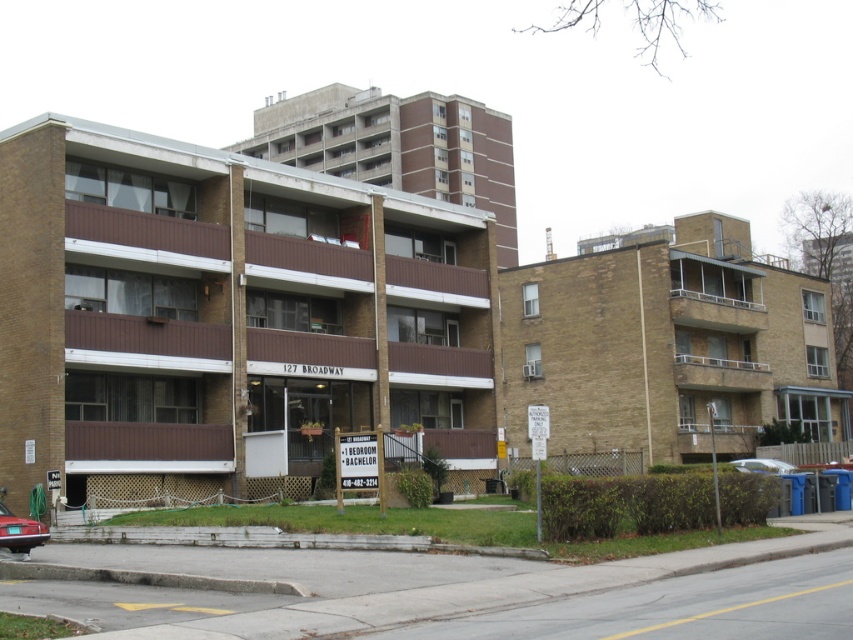
Question: Which object is closer to the camera taking this photo?

Choices:
 (A) white glossy sedan at lower right
 (B) shiny red sedan at lower left

Answer: (B)

Question: Which point is closer to the camera?

Choices:
 (A) white glossy sedan at lower right
 (B) shiny red sedan at lower left

Answer: (B)

Question: Which of the following is the closest to the observer?

Choices:
 (A) (785, 468)
 (B) (20, 524)

Answer: (B)

Question: Does shiny red sedan at lower left come in front of white glossy sedan at lower right?

Choices:
 (A) yes
 (B) no

Answer: (A)

Question: From the image, what is the correct spatial relationship of shiny red sedan at lower left in relation to white glossy sedan at lower right?

Choices:
 (A) left
 (B) right

Answer: (A)

Question: Does shiny red sedan at lower left lie behind white glossy sedan at lower right?

Choices:
 (A) yes
 (B) no

Answer: (B)